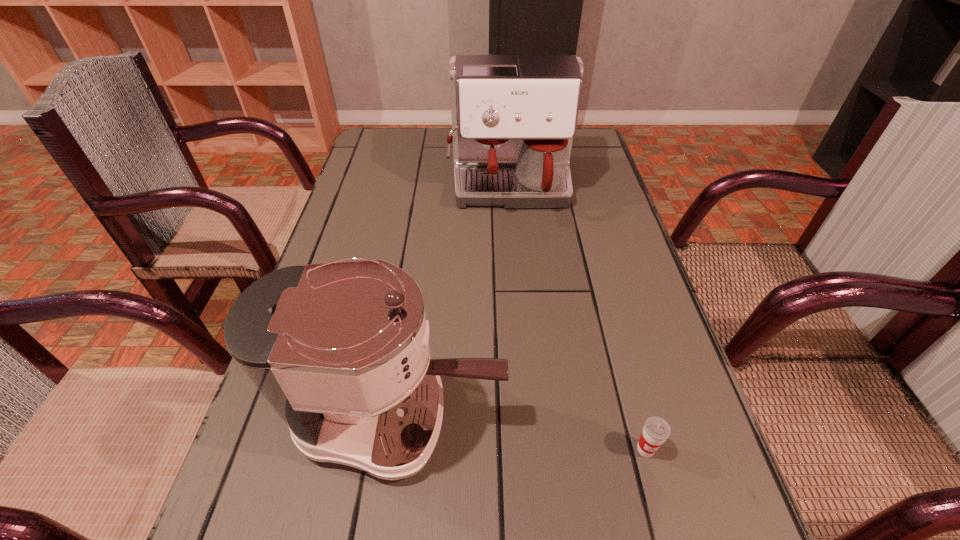
Where is `vacant space at the left edge`? vacant space at the left edge is located at coordinates (374, 182).

The width and height of the screenshot is (960, 540). I want to click on free region at the right edge of the desktop, so click(x=641, y=420).

This screenshot has height=540, width=960. Identify the location of free space between the shortest object and the farther coffee maker. click(x=577, y=320).

Locate an element on the screen. vacant area between the nearer coffee maker and the cup is located at coordinates (522, 434).

At what (x,y) coordinates should I click in order to perform the action: click on vacant area between the nearer coffee maker and the farthest object. Please return your answer as a coordinate pair (x, y). This screenshot has height=540, width=960. Looking at the image, I should click on (454, 304).

The width and height of the screenshot is (960, 540). I want to click on vacant area that lies between the cup and the nearer coffee maker, so click(522, 434).

Locate an element on the screen. The image size is (960, 540). vacant area that lies between the farther coffee maker and the shortest object is located at coordinates (577, 320).

Locate an element on the screen. This screenshot has height=540, width=960. vacant area between the cup and the farthest object is located at coordinates (577, 320).

Image resolution: width=960 pixels, height=540 pixels. Identify the location of free space between the nearer coffee maker and the shortest object. (522, 434).

Image resolution: width=960 pixels, height=540 pixels. I want to click on free space between the nearer coffee maker and the farther coffee maker, so click(454, 304).